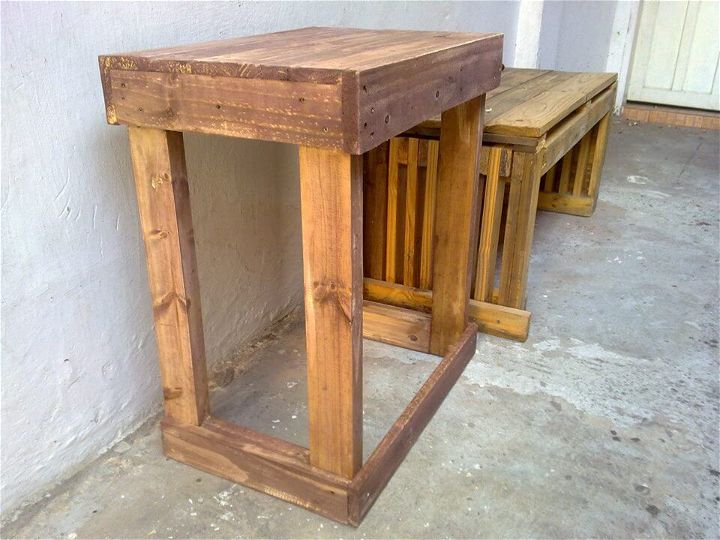
The height and width of the screenshot is (540, 720). What are the coordinates of `white wall` in the screenshot? It's located at (592, 28).